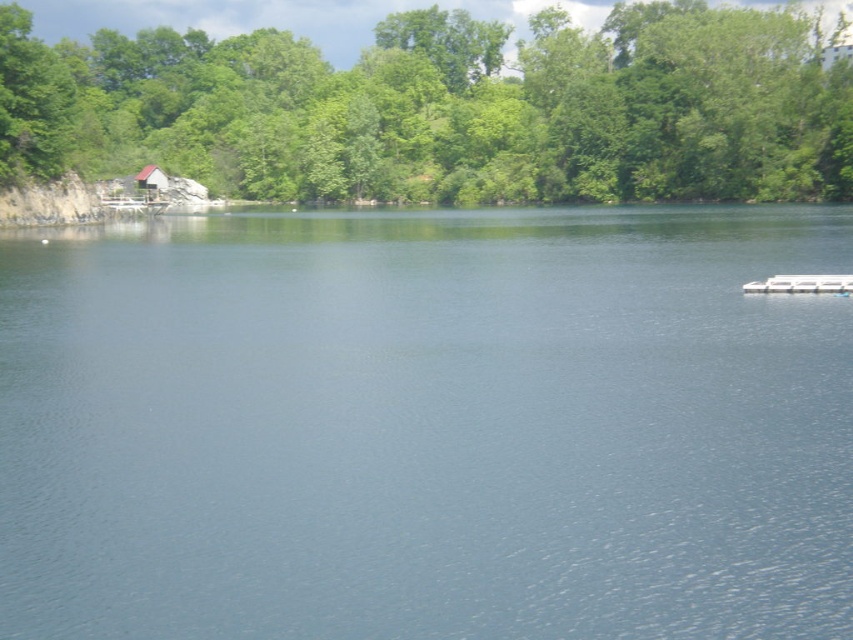
You are planning to build a dock extending from the brown wooden hut at upper left to the clear water at center. The dock you have is 200 feet long. Will it reach the water?

The distance between the brown wooden hut at upper left and the clear water at center is 231.83 feet. Since the dock is only 200 feet long, it will not be sufficient to reach the water.

Based on the photo, you are standing at the edge of the lake and want to reach the brown wooden hut at upper left. Which direction should you head towards from the clear water at center?

The clear water at center is located below the brown wooden hut at upper left, so you should head upwards or towards the upper left direction from the clear water at center to reach the brown wooden hut at upper left.

You are standing at the edge of the lake and notice the clear water at center and the green leafy trees at upper center. Which object is located to the right of the other?

The clear water at center is positioned on the right side of green leafy trees at upper center.